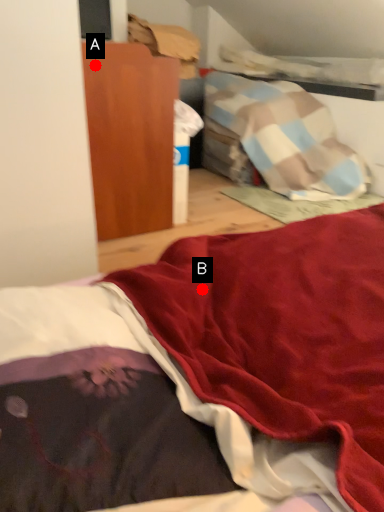
Question: Two points are circled on the image, labeled by A and B beside each circle. Which point is farther from the camera taking this photo?

Choices:
 (A) A is further
 (B) B is further

Answer: (A)